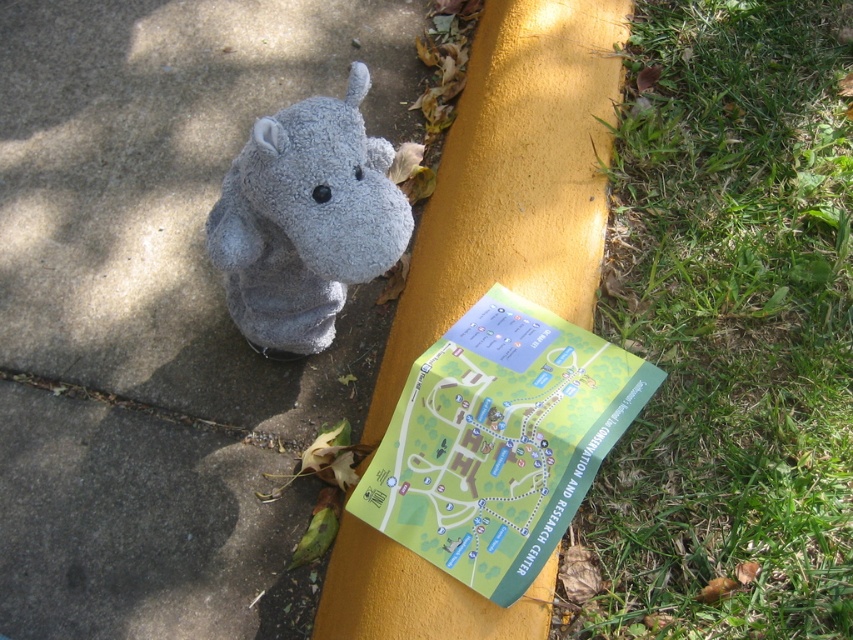
You are standing in a park and see two hippos. One is a gray fabric hippo at center and the other is a soft gray plush hippo at center. Which one is closer to the yellow curb on the left side?

The gray fabric hippo at center is to the left of the soft gray plush hippo at center, so the gray fabric hippo at center is closer to the yellow curb on the left side.

You are standing at the yellow curb next to the plush toy hippo. There are two points marked on the map labeled as point 1 at coordinates [228,16] and point 2 at coordinates [583,484]. According to the map, which point is located behind the other?

Based on the map, point 1 at coordinates [228,16] is behind point 2 at coordinates [583,484].

You are a delivery person who needs to place a small box on either the gray fabric hippo at center or the green paper map at center. Which object can you place the box on without it falling off, considering their heights?

The gray fabric hippo at center has a greater height compared to the green paper map at center, so placing the box on the gray fabric hippo at center would be more stable and less likely to fall off.